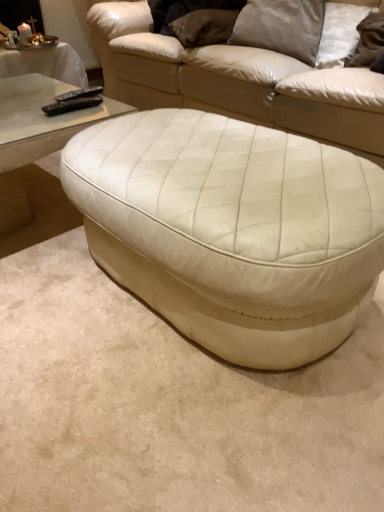
Question: From a real-world perspective, is black plastic remote at upper left, the first remote when ordered from front to back, positioned above or below white leather ottoman at center?

Choices:
 (A) below
 (B) above

Answer: (B)

Question: Relative to white leather ottoman at center, is black plastic remote at upper left, acting as the 2th remote starting from the back, in front or behind?

Choices:
 (A) behind
 (B) front

Answer: (A)

Question: Estimate the real-world distances between objects in this image. Which object is closer to the suede-like beige pillow at upper center, placed as the 1th pillow when sorted from left to right?

Choices:
 (A) black matte remote at upper left, the second remote in the front-to-back sequence
 (B) suede-like brown pillow at upper right, which appears as the third pillow when viewed from the left
 (C) white leather studio couch at center
 (D) black plastic remote at upper left, the first remote when ordered from front to back
 (E) white leather ottoman at center

Answer: (C)

Question: Estimate the real-world distances between objects in this image. Which object is farther from the black matte remote at upper left, the second remote in the front-to-back sequence?

Choices:
 (A) white leather studio couch at center
 (B) white leather ottoman at center
 (C) suede-like brown pillow at upper right, the first pillow viewed from the right
 (D) satin gray pillow at upper center, which appears as the 2th pillow when viewed from the right
 (E) black plastic remote at upper left, the first remote when ordered from front to back

Answer: (C)